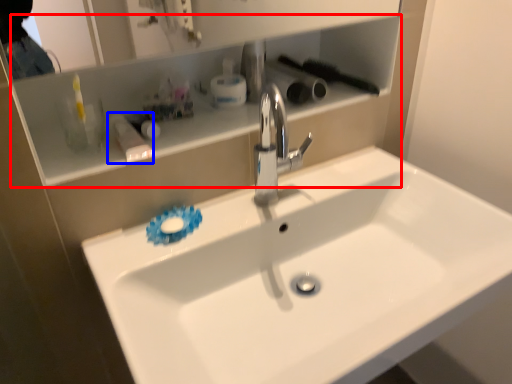
Question: Which object is further to the camera taking this photo, cabinet (highlighted by a red box) or toiletry (highlighted by a blue box)?

Choices:
 (A) cabinet
 (B) toiletry

Answer: (B)